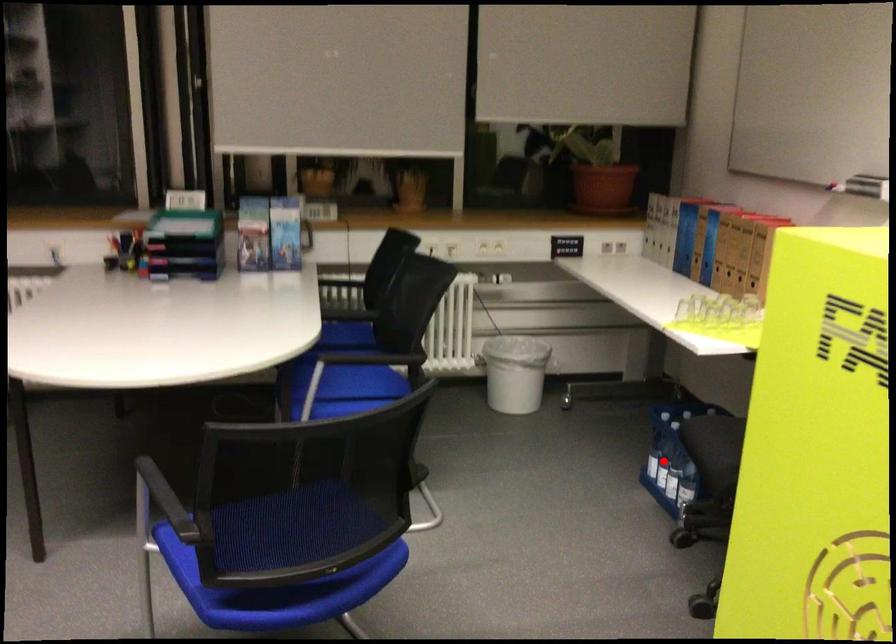
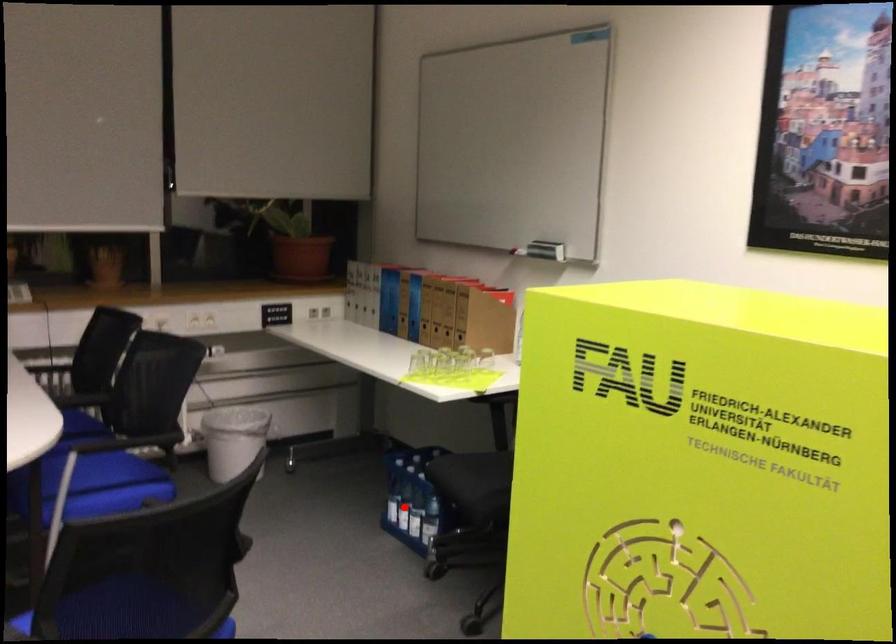
I am providing you with two images of the same scene from different viewpoints. A red point is marked on the first image and another point is marked on the second image. Does the point marked in image1 correspond to the same location as the one in image2?

Yes